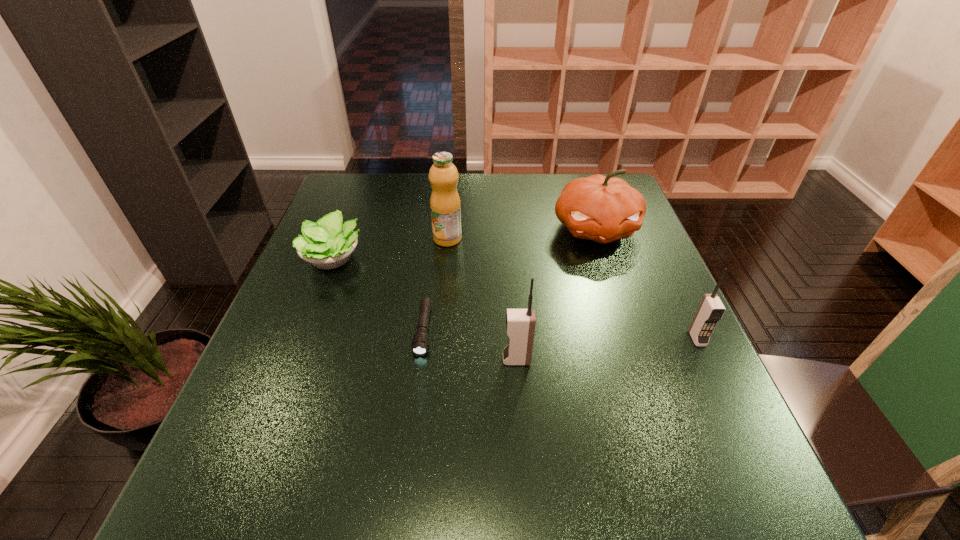
This screenshot has height=540, width=960. In order to click on blank space located 0.240m on the front-facing side of the taller cellular telephone in this screenshot , I will do `click(386, 360)`.

Find the location of a particular element. The image size is (960, 540). vacant space located 0.160m on the front-facing side of the taller cellular telephone is located at coordinates (425, 360).

Identify the location of free space located on the front-facing side of the farther cellular telephone. Image resolution: width=960 pixels, height=540 pixels. (710, 367).

Locate an element on the screen. free space located on the front label of the fruit juice is located at coordinates (438, 347).

You are a GUI agent. You are given a task and a screenshot of the screen. Output one action in this format:
    pyautogui.click(x=<x>, y=<y>)
    Task: Click on the free space located 0.390m on the front face of the pumpkin
    The height and width of the screenshot is (540, 960).
    Given the screenshot: What is the action you would take?
    pyautogui.click(x=647, y=383)

The height and width of the screenshot is (540, 960). Find the location of `vacant region located on the front of the lettuce`. vacant region located on the front of the lettuce is located at coordinates (286, 379).

Where is `free region located at the lens end of the shortest object`? This screenshot has width=960, height=540. free region located at the lens end of the shortest object is located at coordinates (418, 378).

The image size is (960, 540). Find the location of `object that is positioned at the far edge`. object that is positioned at the far edge is located at coordinates (600, 208).

The image size is (960, 540). I want to click on object at the left edge, so click(327, 244).

At what (x,y) coordinates should I click in order to perform the action: click on cellular telephone located in the right edge section of the desktop. Please return your answer as a coordinate pair (x, y). Image resolution: width=960 pixels, height=540 pixels. Looking at the image, I should click on (711, 309).